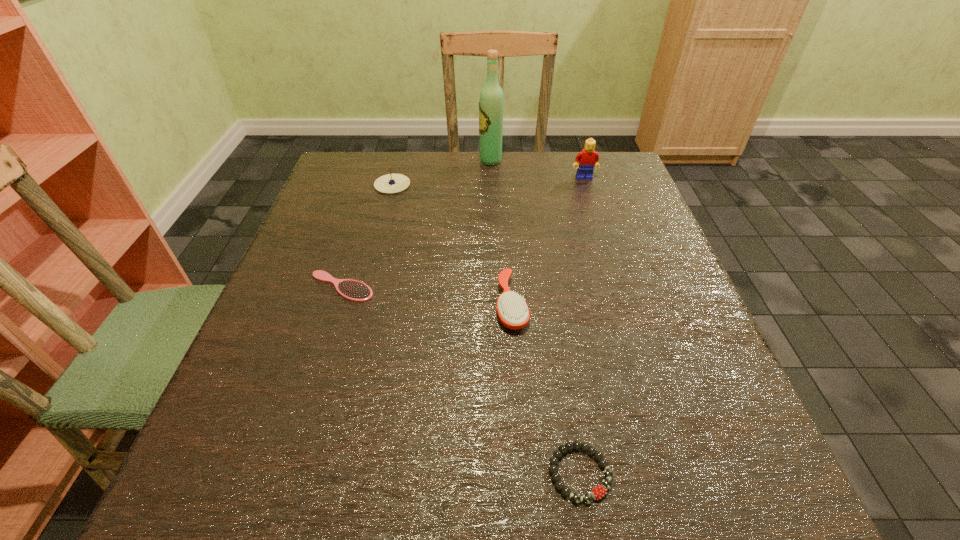
At what (x,y) coordinates should I click in order to perform the action: click on the shortest object. Please return your answer as a coordinate pair (x, y). Looking at the image, I should click on (598, 492).

The height and width of the screenshot is (540, 960). I want to click on vacant region located 0.180m on the front-facing side of the tallest object, so (415, 161).

In order to click on free location located on the front-facing side of the tallest object in this screenshot , I will do `click(458, 161)`.

Locate an element on the screen. The height and width of the screenshot is (540, 960). blank space located 0.310m on the front-facing side of the tallest object is located at coordinates (369, 161).

Find the location of a particular element. This screenshot has height=540, width=960. free space located on the face of the Lego is located at coordinates (591, 200).

I want to click on vacant space situated on the right of the compass, so click(x=494, y=184).

You are a GUI agent. You are given a task and a screenshot of the screen. Output one action in this format:
    pyautogui.click(x=<x>, y=<y>)
    Task: Click on the free space located 0.050m on the right of the fourth tallest object
    
    Given the screenshot: What is the action you would take?
    pyautogui.click(x=553, y=305)

This screenshot has width=960, height=540. In order to click on free space located on the back of the left hairbrush in this screenshot , I will do `click(378, 173)`.

Identify the location of free region located 0.350m on the back of the bracelet. This screenshot has width=960, height=540. (549, 278).

Locate an element on the screen. wine bottle that is at the far edge is located at coordinates (491, 102).